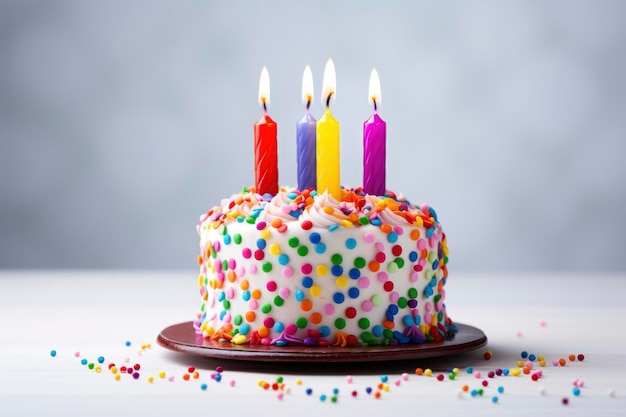
Identify the location of birthday candle flames. This screenshot has height=417, width=626. (265, 87), (305, 84), (327, 82), (372, 92).